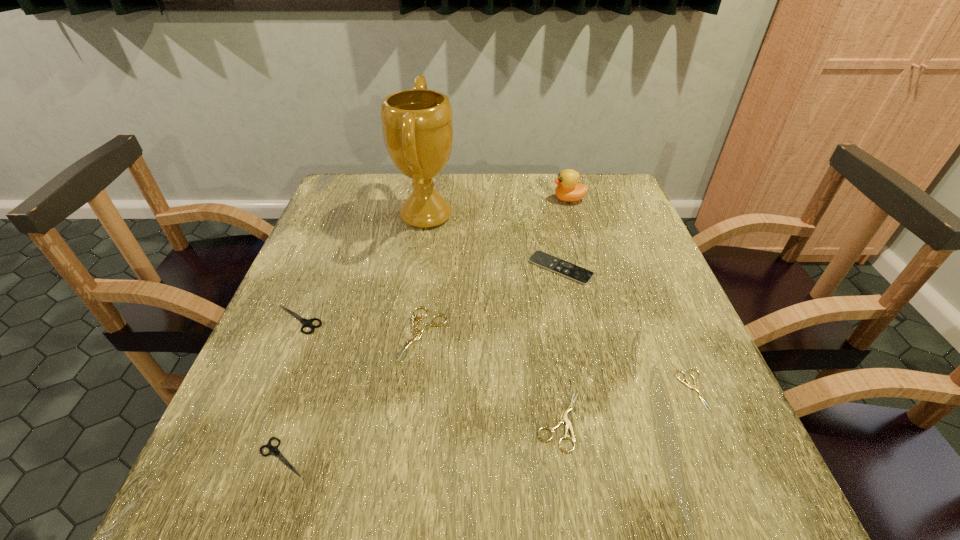
Identify the location of vacant space at the near edge of the desktop. (632, 524).

In order to click on free space at the left edge of the desktop in this screenshot , I will do `click(354, 291)`.

Where is `vacant space at the right edge of the desktop`? The width and height of the screenshot is (960, 540). vacant space at the right edge of the desktop is located at coordinates (704, 411).

Where is `vacant space at the near left corner`? vacant space at the near left corner is located at coordinates (222, 505).

This screenshot has width=960, height=540. I want to click on vacant space at the far right corner of the desktop, so click(633, 204).

At what (x,y) coordinates should I click in order to perform the action: click on vacant area between the shortest shears and the nearer black shears. Please return your answer as a coordinate pair (x, y). Image resolution: width=960 pixels, height=540 pixels. Looking at the image, I should click on (488, 423).

The width and height of the screenshot is (960, 540). Find the location of `blank region between the yellow duckling and the leftmost beige shears`. blank region between the yellow duckling and the leftmost beige shears is located at coordinates tap(495, 266).

Find the location of `free space between the fourth shears from left to right and the sixth shortest object`. free space between the fourth shears from left to right and the sixth shortest object is located at coordinates (560, 344).

Image resolution: width=960 pixels, height=540 pixels. In order to click on free space between the bigger black shears and the duckling in this screenshot , I will do `click(434, 259)`.

You are a GUI agent. You are given a task and a screenshot of the screen. Output one action in this format:
    pyautogui.click(x=<x>, y=<y>)
    Task: Click on the vacant space that is in between the yellow duckling and the rightmost beige shears
    This screenshot has width=960, height=540.
    Given the screenshot: What is the action you would take?
    pyautogui.click(x=631, y=294)